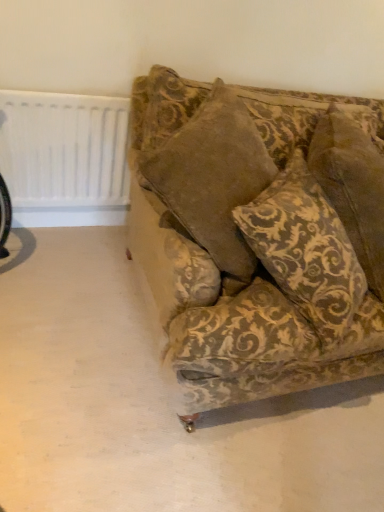
Question: In terms of width, does velvet gold-patterned pillow at center look wider or thinner when compared to white plastic radiator at upper left?

Choices:
 (A) wide
 (B) thin

Answer: (A)

Question: From the image's perspective, is velvet gold-patterned pillow at center above or below white plastic radiator at upper left?

Choices:
 (A) above
 (B) below

Answer: (B)

Question: Which of these objects is positioned farthest from the velvet gold-patterned pillow at center?

Choices:
 (A) velvet-patterned couch at center
 (B) white plastic radiator at upper left

Answer: (B)

Question: Estimate the real-world distances between objects in this image. Which object is closer to the velvet-patterned couch at center?

Choices:
 (A) velvet gold-patterned pillow at center
 (B) white plastic radiator at upper left

Answer: (A)